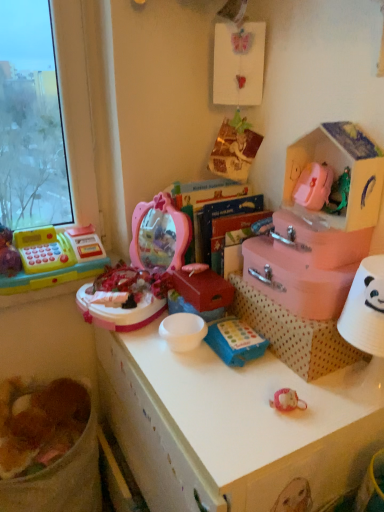
The height and width of the screenshot is (512, 384). What are the coordinates of `vacant space situated above white plastic desk at center (from a real-world perspective)` in the screenshot? It's located at (233, 374).